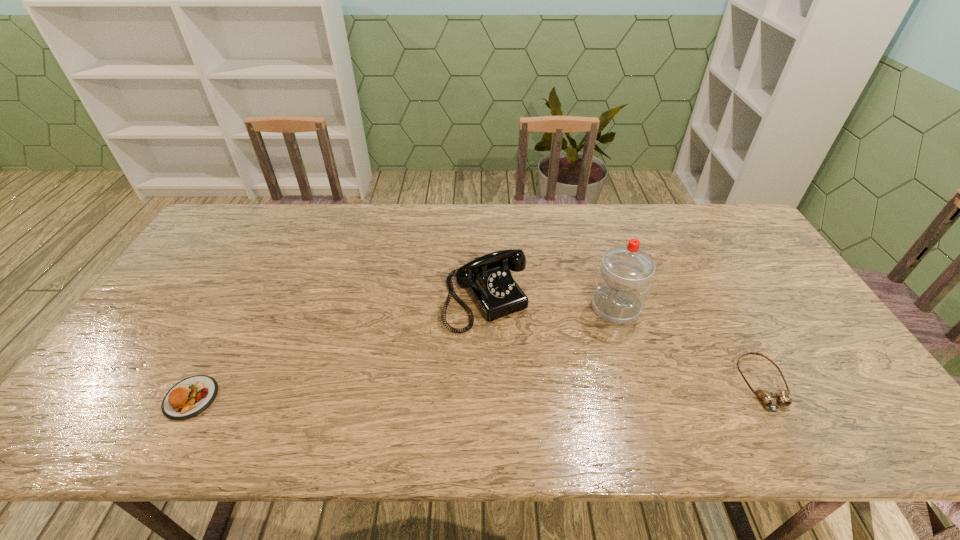
Where is `empty location between the second object from right to left and the patty (food)`? empty location between the second object from right to left and the patty (food) is located at coordinates (403, 353).

Locate an element on the screen. Image resolution: width=960 pixels, height=540 pixels. free area in between the water bottle and the shortest object is located at coordinates (689, 346).

Where is `object that ranks as the second closest to the tallest object`? This screenshot has width=960, height=540. object that ranks as the second closest to the tallest object is located at coordinates (767, 397).

Choose which object is the nearest neighbor to the goggles. Please provide its 2D coordinates. Your answer should be formatted as a tuple, i.e. [(x, y)], where the tuple contains the x and y coordinates of a point satisfying the conditions above.

[(624, 278)]

This screenshot has height=540, width=960. Identify the location of vacant area that satisfies the following two spatial constraints: 1. on the back side of the third shortest object; 2. on the right side of the leftmost object. (245, 299).